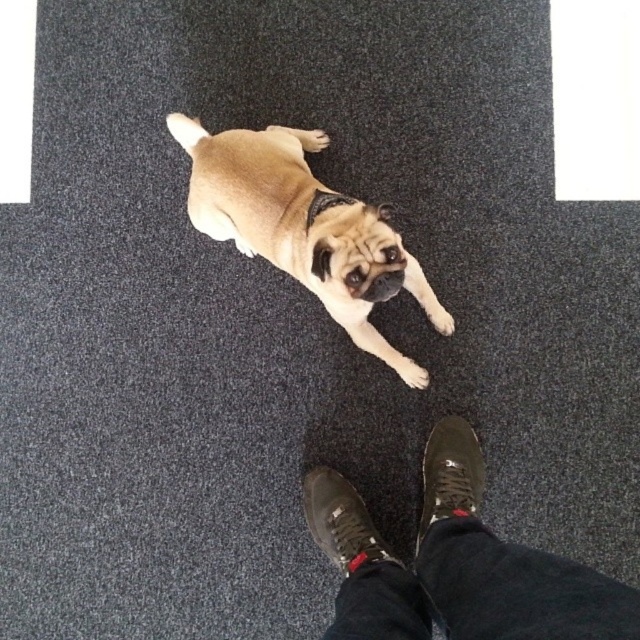
Question: Can you confirm if furry beige dog at center is positioned below leather sneaker at lower center?

Choices:
 (A) no
 (B) yes

Answer: (A)

Question: Estimate the real-world distances between objects in this image. Which object is closer to the light brown fur paw at center?

Choices:
 (A) black leather shoes at center
 (B) leather sneaker at lower center
 (C) black leather shoe at lower center
 (D) furry beige dog at center

Answer: (B)

Question: Does black leather shoes at center appear on the left side of light brown fur paw at center?

Choices:
 (A) yes
 (B) no

Answer: (B)

Question: Can you confirm if leather sneaker at lower center is positioned below light brown fur paw at center?

Choices:
 (A) yes
 (B) no

Answer: (A)

Question: Which object is closer to the camera taking this photo?

Choices:
 (A) white fur paw at center
 (B) leather sneaker at lower center
 (C) furry beige dog at center
 (D) black leather shoe at lower center

Answer: (C)

Question: Which of the following is the closest to the observer?

Choices:
 (A) black leather shoes at center
 (B) furry beige dog at center
 (C) leather sneaker at lower center

Answer: (A)